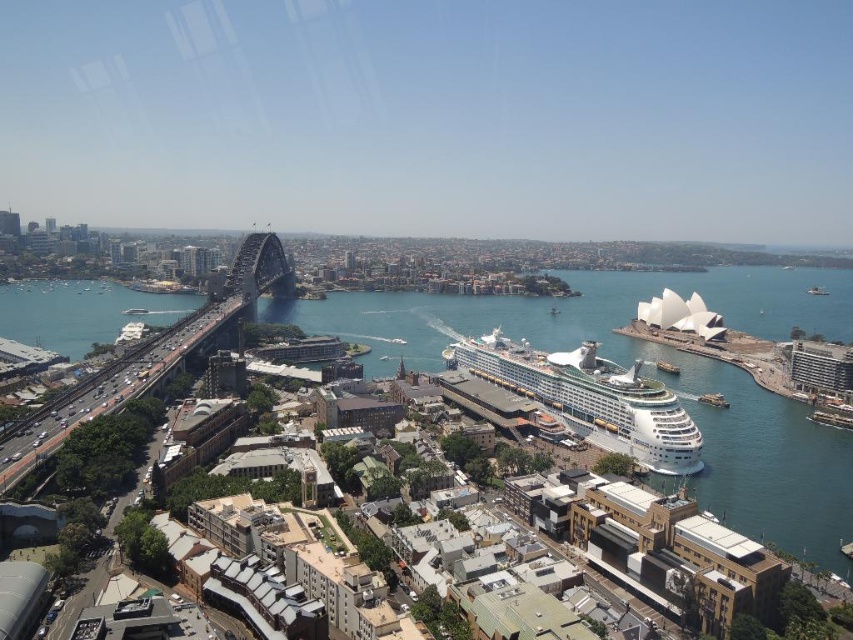
You are a photographer planning to capture a wide shot of Sydney Harbour. You want to ensure that both the clear blue water at center and the metallic gray bridge at left are clearly visible in your composition. Based on their relative heights, which object should you position closer to the bottom of the frame to achieve this?

The metallic gray bridge at left should be positioned closer to the bottom of the frame because the clear blue water at center has a greater height, allowing it to occupy more space towards the top while still including the bridge at the bottom for balance.

You are a tour guide leading a group on a walking tour in Sydney. You want to point out the distance between the clear blue water at center and the white glossy cruise ship at center. How far apart are they?

The distance between the clear blue water at center and the white glossy cruise ship at center is 113.46 meters.

You are standing at the observation deck of the Sydney Harbour Bridge and want to take a photo of the white glossy cruise ship at center. If your camera has a maximum focusing range of 200 meters, will it be able to capture the ship clearly?

The white glossy cruise ship at center is 197.63 meters away from the camera. Since this distance is within the camera maximum focusing range of 200 meters, the camera can capture the ship clearly.